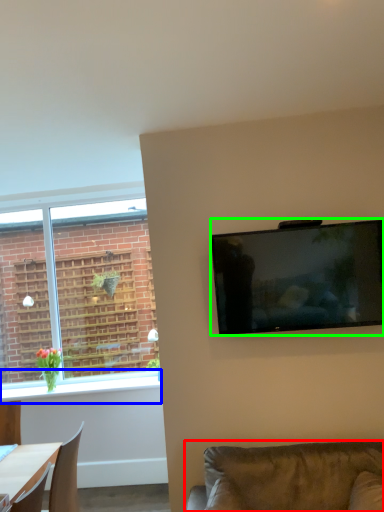
Question: Which object is positioned farthest from studio couch (highlighted by a red box)? Select from window sill (highlighted by a blue box) and television (highlighted by a green box).

Choices:
 (A) window sill
 (B) television

Answer: (A)